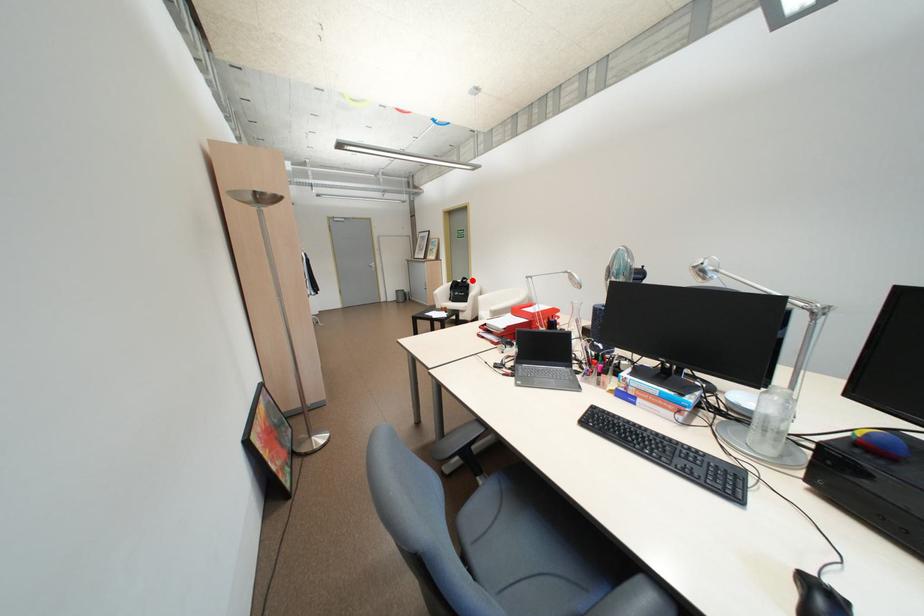
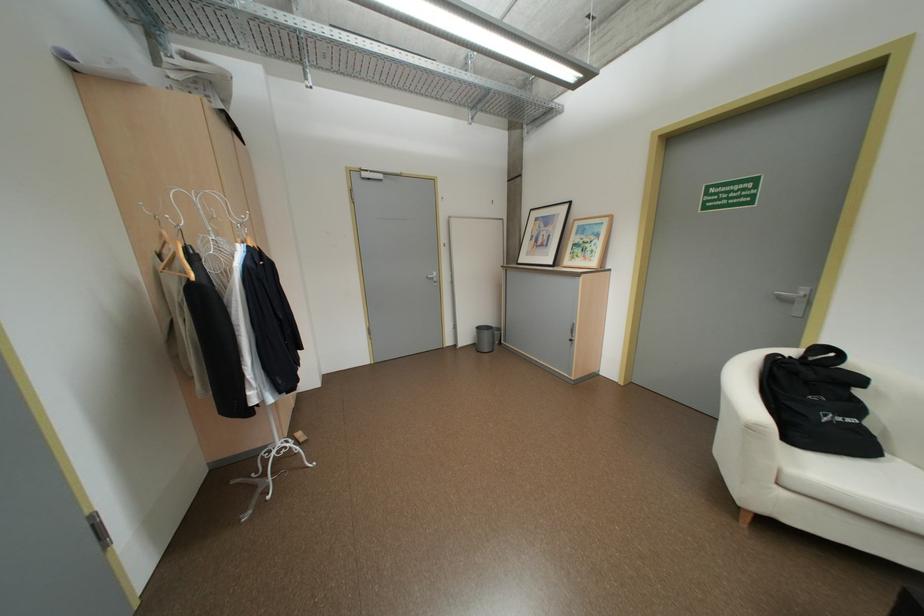
The point at the highlighted location is marked in the first image. Where is the corresponding point in the second image?

(815, 355)